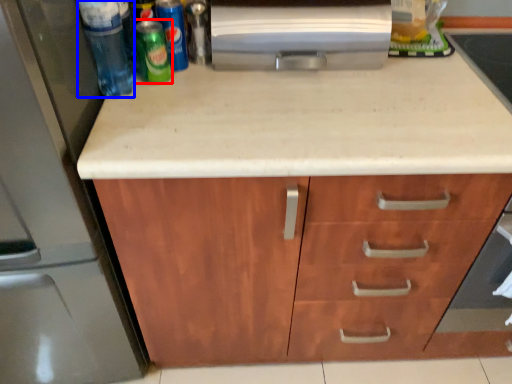
Question: Which point is closer to the camera, beer (highlighted by a red box) or beverage (highlighted by a blue box)?

Choices:
 (A) beer
 (B) beverage

Answer: (B)